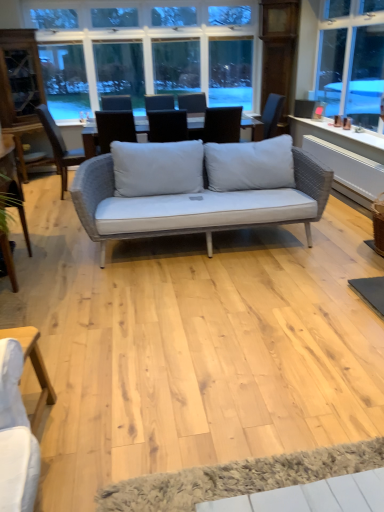
Where is `vacant space behind white textured yoga mat at lower center`? vacant space behind white textured yoga mat at lower center is located at coordinates (232, 382).